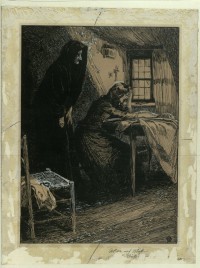
You are a GUI agent. You are given a task and a screenshot of the screen. Output one action in this format:
    pyautogui.click(x=<x>, y=<y>)
    Task: Click on the right legs of chair
    The width and height of the screenshot is (200, 268).
    Given the screenshot: What is the action you would take?
    pyautogui.click(x=28, y=221), pyautogui.click(x=73, y=218)